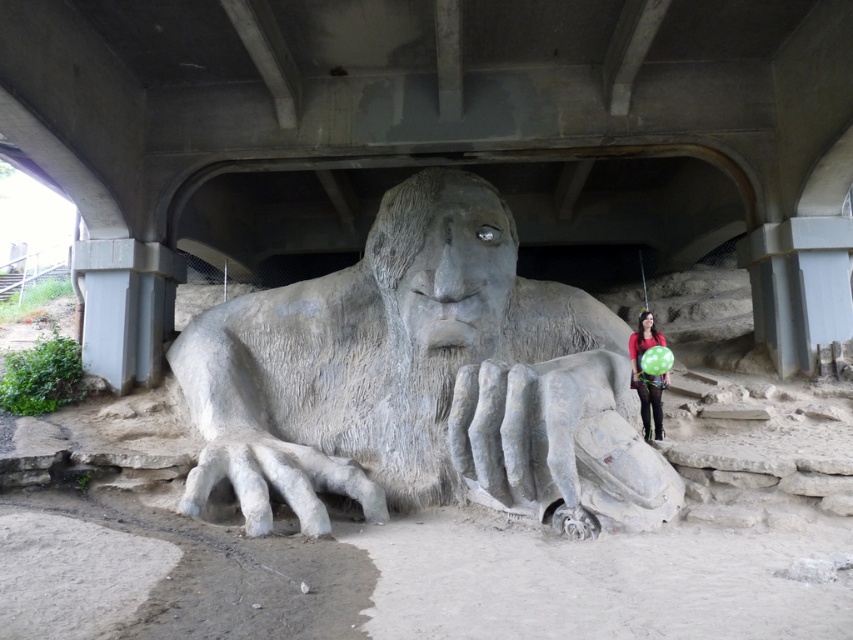
You are standing under the bridge and want to place a small flowerpot between the concrete at center and the stone statue at center. Based on their positions, which object should the flowerpot be closer to if it needs to be placed exactly halfway between them?

The flowerpot should be placed closer to the stone statue at center because the concrete at center is to the left of the stone statue at center, so halfway would be closer to the statue.

You are a photographer planning to take a portrait of a person wearing a matte black dress at lower right. You want to ensure the dress is the main focus. Given the scene with the large stone sculpture and the concrete at center, which object should you avoid placing in the foreground to keep the dress visible?

You should avoid placing the concrete at center in the foreground because it is bigger than the matte black dress at lower right and could overshadow it.